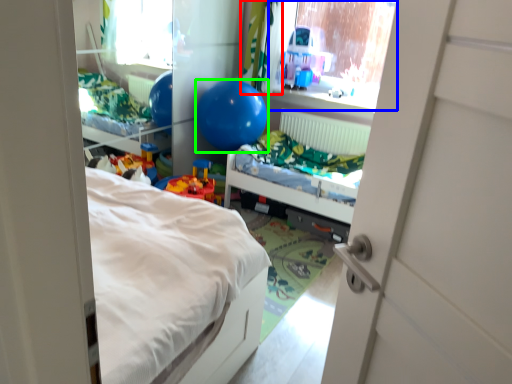
Question: Which is farther away from curtain (highlighted by a red box)? window screen (highlighted by a blue box) or balloon (highlighted by a green box)?

Choices:
 (A) window screen
 (B) balloon

Answer: (A)